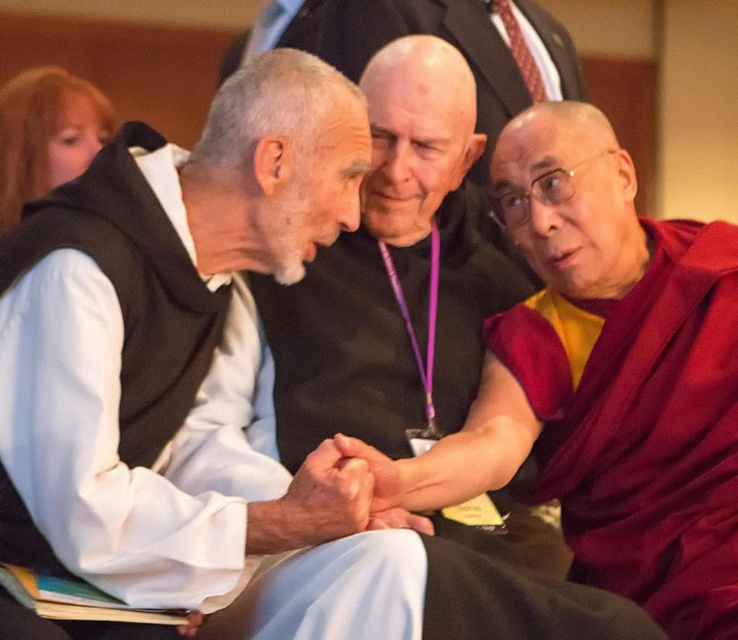
Between maroon silk robe at center and maroon silk robe at right, which one appears on the right side from the viewer's perspective?

maroon silk robe at right is more to the right.

Between point (520, 326) and point (579, 300), which one is positioned in front?

Positioned in front is point (520, 326).

Find the location of a particular element. maroon silk robe at center is located at coordinates (604, 378).

Who is shorter, maroon silk robe at right or white clothed man at center?

Standing shorter between the two is maroon silk robe at right.

Does point (601, 436) come behind point (438, 214)?

No, it is in front of (438, 214).

Is point (582, 532) less distant than point (413, 369)?

No, it is not.

Where is `maroon silk robe at right`? maroon silk robe at right is located at coordinates (641, 426).

Is maroon silk robe at center wider than white clothed man at center?

Yes, maroon silk robe at center is wider than white clothed man at center.

Who is shorter, maroon silk robe at center or white clothed man at center?

maroon silk robe at center is shorter.

The width and height of the screenshot is (738, 640). What do you see at coordinates (604, 378) in the screenshot?
I see `maroon silk robe at center` at bounding box center [604, 378].

Find the location of a particular element. maroon silk robe at center is located at coordinates (604, 378).